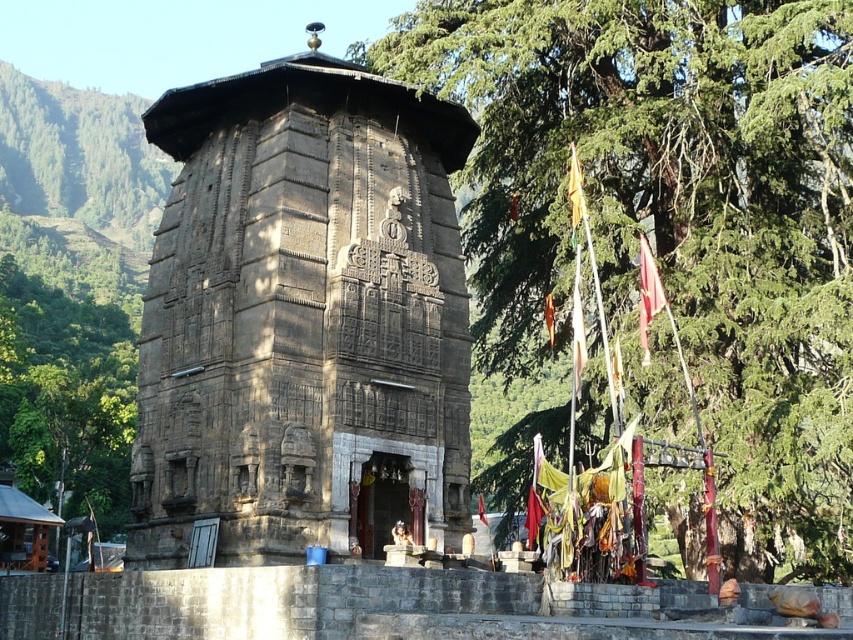
Consider the image. You are standing at the camera position and want to take a photo of the green leafy tree at upper center. The camera has a maximum zoom range of 50 meters. Will you be able to capture the tree in focus without moving closer?

The green leafy tree at upper center and camera are 48.88 meters apart, which is within the camera maximum zoom range of 50 meters. Therefore, you can capture the tree in focus without moving closer.

You are a visitor standing in front of the brown stone temple at center and looking towards the green leafy tree at upper center. Which object appears wider from your perspective?

The green leafy tree at upper center appears wider than the brown stone temple at center because its width is larger according to the description.

You are a visitor standing in front of the brown stone temple at center. You want to take a photo of the temple with the green leafy tree at upper center in the background. Which side should you stand to ensure the tree appears behind the temple?

You should stand to the left side of the brown stone temple at center so that the green leafy tree at upper center, which is located to the right of the temple, will appear behind it in your photo.